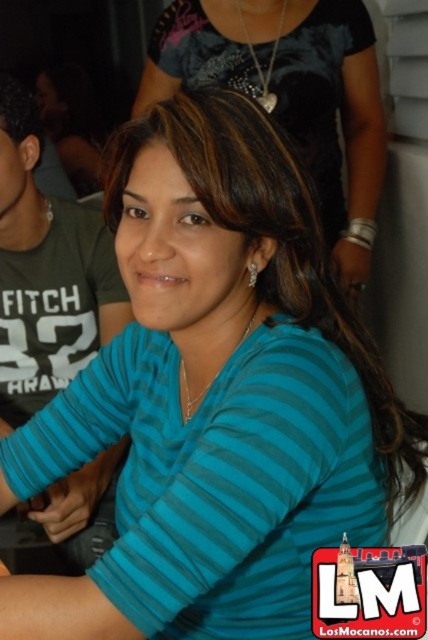
You are at a casual social gathering and want to take a photo with the woman wearing the blue striped shirt at center. However, you notice another person in a green cotton shirt at left. Which shirt should you stand closer to if you want to include both in your photo without cropping either?

You should stand closer to the blue striped shirt at center because it is shorter than the green cotton shirt at left, allowing both to fit within the frame more easily.

In the scene described, there are two shirts visible. The blue striped shirt at center and the green cotton shirt at left. From the perspective of someone facing the image, which shirt is positioned more to the left?

The green cotton shirt at left is positioned more to the left compared to the blue striped shirt at center, as the blue striped shirt at center is located to the right of the green cotton shirt at left.